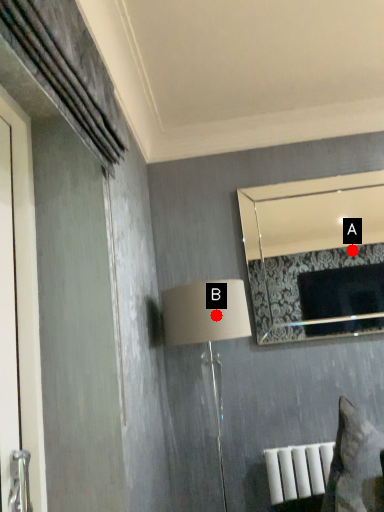
Question: Two points are circled on the image, labeled by A and B beside each circle. Which of the following is the farthest from the observer?

Choices:
 (A) A is further
 (B) B is further

Answer: (A)